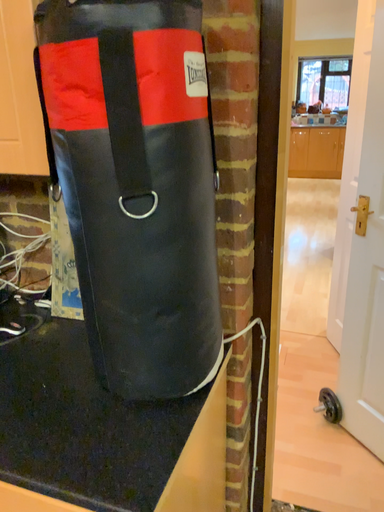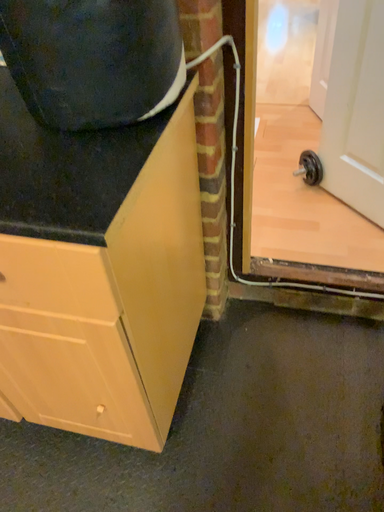
Question: Which way did the camera rotate in the video?

Choices:
 (A) rotated downward
 (B) rotated upward

Answer: (A)